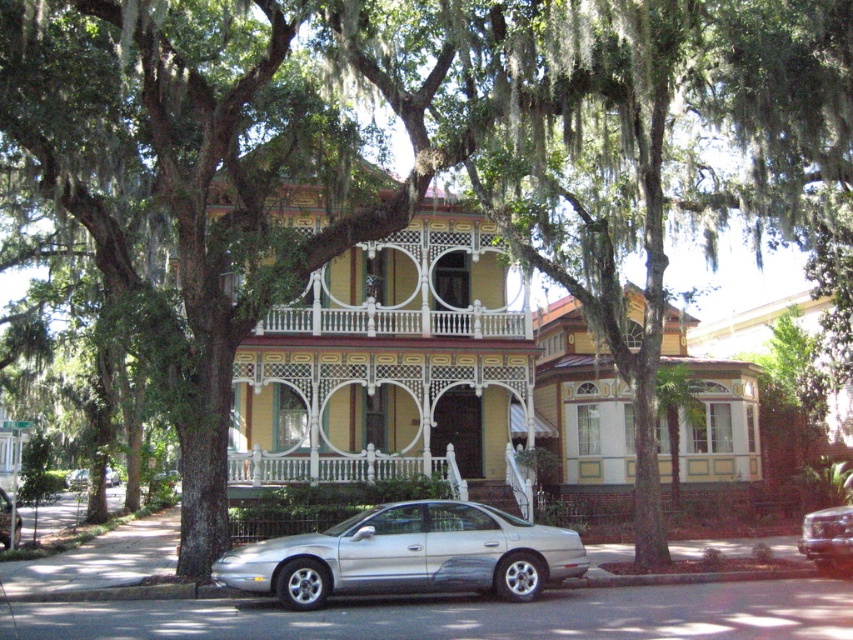
You are a delivery person trying to park your truck next to the house. You see a silver metallic car at center and a metallic silver sedan at center. Which vehicle should you park next to to ensure enough space for your truck?

You should park next to the metallic silver sedan at center because it is narrower than the silver metallic car at center, leaving more space for your truck.

You are standing on the sidewalk in front of the Victorian house. You want to take a photo of the balcony with the intricate white railings and circular cutouts. The camera you are using has a focal length of 50mm and a sensor size of 24mm x 36mm. The point at coordinates point (352,548) is where you want to focus. Given that the distance from the camera to this point is 15.47 meters, what is the minimum aperture setting you should use to ensure that the entire balcony is in focus with a depth of field?

The minimum aperture setting required to ensure the entire balcony is in focus with a depth of field would depend on calculating the hyperfocal distance or using a depth of field calculator. However, since the distance to the point is 15.47 meters, and assuming typical photography parameters, a smaller aperture like f8 or f11 is recommended to achieve sufficient depth of field for the balcony details.

You are a delivery person who needs to park your van in front of the two silver metallic vehicles at center. The van is 6 meters long. Can you fit your van between the silver metallic car at center and the silver metallic sedan at center?

The silver metallic car at center is smaller than the silver metallic sedan at center, but the exact distance between them isn t specified. Without knowing the space between the two vehicles, it s impossible to determine if the van will fit.